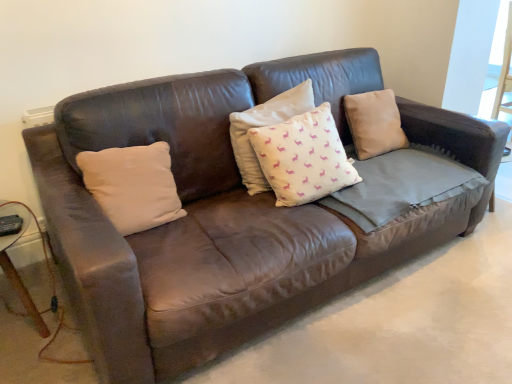
Describe the element at coordinates (303, 157) in the screenshot. I see `white cotton cushion at center, which is the 2th pillow from left to right` at that location.

This screenshot has width=512, height=384. Identify the location of wooden side table at lower left. (14, 266).

Based on the photo, considering the positions of objects wooden side table at lower left and white matte pillow at center, acting as the first pillow starting from the left, in the image provided, who is more to the right, wooden side table at lower left or white matte pillow at center, acting as the first pillow starting from the left,?

From the viewer's perspective, white matte pillow at center, acting as the first pillow starting from the left, appears more on the right side.

Which of these two, wooden side table at lower left or white matte pillow at center, the 3th pillow in the right-to-left sequence, is wider?

Wider between the two is wooden side table at lower left.

Does point (4, 239) come farther from viewer compared to point (132, 177)?

No, it is not.

From the picture: From a real-world perspective, is wooden side table at lower left positioned over white matte pillow at center, the 3th pillow in the right-to-left sequence, based on gravity?

Incorrect, from a real-world perspective, wooden side table at lower left is lower than white matte pillow at center, the 3th pillow in the right-to-left sequence.

Is white matte pillow at center, acting as the first pillow starting from the left, situated inside wooden side table at lower left or outside?

white matte pillow at center, acting as the first pillow starting from the left, is located beyond the bounds of wooden side table at lower left.

Is white matte pillow at center, the 3th pillow in the right-to-left sequence, positioned far away from wooden side table at lower left?

That's not correct — white matte pillow at center, the 3th pillow in the right-to-left sequence, is a little close to wooden side table at lower left.

You are a GUI agent. You are given a task and a screenshot of the screen. Output one action in this format:
    pyautogui.click(x=<x>, y=<y>)
    Task: Click on the side table in front of the white matte pillow at center, acting as the first pillow starting from the left
    This screenshot has width=512, height=384.
    Given the screenshot: What is the action you would take?
    pyautogui.click(x=14, y=266)

From a real-world perspective, who is located higher, white matte pillow at center, acting as the first pillow starting from the left, or wooden side table at lower left?

In real-world perspective, white matte pillow at center, acting as the first pillow starting from the left, is above.

Is brown leather pillow at upper right, which is the third pillow from left to right, directly adjacent to wooden side table at lower left?

No, brown leather pillow at upper right, which is the third pillow from left to right, is not with wooden side table at lower left.

Is brown leather pillow at upper right, arranged as the 1th pillow when viewed from the right, smaller than wooden side table at lower left?

Yes.

The height and width of the screenshot is (384, 512). I want to click on side table on the left of the brown leather pillow at upper right, arranged as the 1th pillow when viewed from the right, so click(14, 266).

Considering the sizes of objects brown leather pillow at upper right, which is the third pillow from left to right, and wooden side table at lower left in the image provided, who is shorter, brown leather pillow at upper right, which is the third pillow from left to right, or wooden side table at lower left?

brown leather pillow at upper right, which is the third pillow from left to right, is shorter.

From the image's perspective, would you say wooden side table at lower left is shown under white cotton cushion at center, acting as the 2th pillow starting from the right?

Yes.

Could you tell me if wooden side table at lower left is facing white cotton cushion at center, which is the 2th pillow from left to right?

No, wooden side table at lower left does not turn towards white cotton cushion at center, which is the 2th pillow from left to right.

Image resolution: width=512 pixels, height=384 pixels. Find the location of `the 2nd pillow behind the wooden side table at lower left, starting your count from the anchor`. the 2nd pillow behind the wooden side table at lower left, starting your count from the anchor is located at coordinates (303, 157).

Based on the photo, considering the positions of objects wooden side table at lower left and white cotton cushion at center, which is the 2th pillow from left to right, in the image provided, who is more to the left, wooden side table at lower left or white cotton cushion at center, which is the 2th pillow from left to right,?

wooden side table at lower left is more to the left.

Which is farther from the camera, (154, 172) or (393, 147)?

The point (393, 147) is behind.

Is white matte pillow at center, acting as the first pillow starting from the left, positioned far away from brown leather pillow at upper right, which is the third pillow from left to right?

Yes, white matte pillow at center, acting as the first pillow starting from the left, and brown leather pillow at upper right, which is the third pillow from left to right, are located far from each other.

Can you confirm if white matte pillow at center, acting as the first pillow starting from the left, is wider than brown leather pillow at upper right, which is the third pillow from left to right?

In fact, white matte pillow at center, acting as the first pillow starting from the left, might be narrower than brown leather pillow at upper right, which is the third pillow from left to right.

Is white matte pillow at center, acting as the first pillow starting from the left, aimed at brown leather pillow at upper right, which is the third pillow from left to right?

No, white matte pillow at center, acting as the first pillow starting from the left, does not turn towards brown leather pillow at upper right, which is the third pillow from left to right.

From a real-world perspective, relative to white cotton cushion at center, acting as the 2th pillow starting from the right, is white matte pillow at center, acting as the first pillow starting from the left, vertically above or below?

Clearly, from a real-world perspective, white matte pillow at center, acting as the first pillow starting from the left, is below white cotton cushion at center, acting as the 2th pillow starting from the right.

Is the surface of white matte pillow at center, acting as the first pillow starting from the left, in direct contact with white cotton cushion at center, acting as the 2th pillow starting from the right?

No, white matte pillow at center, acting as the first pillow starting from the left, is not in contact with white cotton cushion at center, acting as the 2th pillow starting from the right.

Considering the relative sizes of white matte pillow at center, acting as the first pillow starting from the left, and white cotton cushion at center, which is the 2th pillow from left to right, in the image provided, is white matte pillow at center, acting as the first pillow starting from the left, thinner than white cotton cushion at center, which is the 2th pillow from left to right,?

Correct, the width of white matte pillow at center, acting as the first pillow starting from the left, is less than that of white cotton cushion at center, which is the 2th pillow from left to right.

Find the location of a particular element. This screenshot has width=512, height=384. side table in front of the white cotton cushion at center, acting as the 2th pillow starting from the right is located at coordinates (14, 266).

From the image's perspective, is white cotton cushion at center, acting as the 2th pillow starting from the right, over wooden side table at lower left?

Yes, from the image's perspective, white cotton cushion at center, acting as the 2th pillow starting from the right, is above wooden side table at lower left.

Considering the sizes of white cotton cushion at center, which is the 2th pillow from left to right, and wooden side table at lower left in the image, is white cotton cushion at center, which is the 2th pillow from left to right, wider or thinner than wooden side table at lower left?

white cotton cushion at center, which is the 2th pillow from left to right, is thinner than wooden side table at lower left.

In the scene shown: Would you consider white cotton cushion at center, which is the 2th pillow from left to right, to be distant from wooden side table at lower left?

Yes, white cotton cushion at center, which is the 2th pillow from left to right, is far from wooden side table at lower left.

This screenshot has width=512, height=384. Identify the location of pillow that is the 1st object located behind the wooden side table at lower left. (133, 185).

The image size is (512, 384). I want to click on side table below the white matte pillow at center, the 3th pillow in the right-to-left sequence (from a real-world perspective), so click(14, 266).

From the picture: From the image, which object appears to be nearer to white cotton cushion at center, which is the 2th pillow from left to right, wooden side table at lower left or brown leather pillow at upper right, which is the third pillow from left to right?

brown leather pillow at upper right, which is the third pillow from left to right, is closer to white cotton cushion at center, which is the 2th pillow from left to right.

Which object lies further to the anchor point wooden side table at lower left, white cotton cushion at center, acting as the 2th pillow starting from the right, or brown leather pillow at upper right, arranged as the 1th pillow when viewed from the right?

Based on the image, brown leather pillow at upper right, arranged as the 1th pillow when viewed from the right, appears to be further to wooden side table at lower left.

Based on their spatial positions, is brown leather pillow at upper right, which is the third pillow from left to right, or wooden side table at lower left closer to white matte pillow at center, acting as the first pillow starting from the left?

Based on the image, wooden side table at lower left appears to be nearer to white matte pillow at center, acting as the first pillow starting from the left.

Estimate the real-world distances between objects in this image. Which object is further from brown leather pillow at upper right, which is the third pillow from left to right, white matte pillow at center, the 3th pillow in the right-to-left sequence, or wooden side table at lower left?

wooden side table at lower left.

Which object lies nearer to the anchor point brown leather pillow at upper right, arranged as the 1th pillow when viewed from the right, wooden side table at lower left or white matte pillow at center, the 3th pillow in the right-to-left sequence?

white matte pillow at center, the 3th pillow in the right-to-left sequence, is positioned closer to the anchor brown leather pillow at upper right, arranged as the 1th pillow when viewed from the right.

From the image, which object appears to be nearer to white cotton cushion at center, acting as the 2th pillow starting from the right, white matte pillow at center, acting as the first pillow starting from the left, or wooden side table at lower left?

Based on the image, white matte pillow at center, acting as the first pillow starting from the left, appears to be nearer to white cotton cushion at center, acting as the 2th pillow starting from the right.

From the image, which object appears to be nearer to wooden side table at lower left, brown leather pillow at upper right, which is the third pillow from left to right, or white cotton cushion at center, which is the 2th pillow from left to right?

The object closer to wooden side table at lower left is white cotton cushion at center, which is the 2th pillow from left to right.

When comparing their distances from brown leather pillow at upper right, arranged as the 1th pillow when viewed from the right, does wooden side table at lower left or white cotton cushion at center, which is the 2th pillow from left to right, seem further?

wooden side table at lower left is further to brown leather pillow at upper right, arranged as the 1th pillow when viewed from the right.

Identify the location of pillow located between white matte pillow at center, the 3th pillow in the right-to-left sequence, and brown leather pillow at upper right, arranged as the 1th pillow when viewed from the right, in the left-right direction. This screenshot has width=512, height=384. click(303, 157).

Image resolution: width=512 pixels, height=384 pixels. What are the coordinates of `pillow between wooden side table at lower left and white cotton cushion at center, acting as the 2th pillow starting from the right, from left to right` in the screenshot? It's located at pyautogui.click(x=133, y=185).